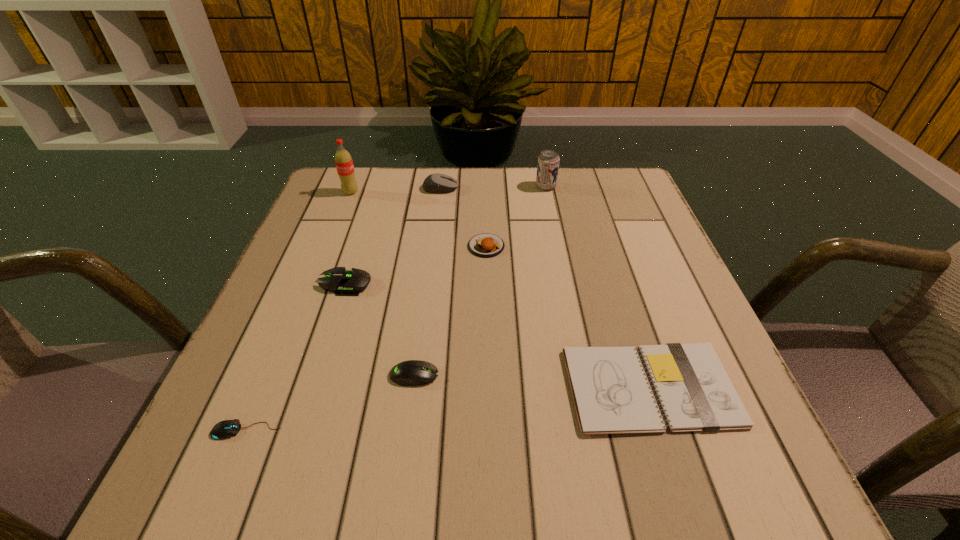
Identify the location of free space between the notepad and the second nearest mouse. (533, 381).

Find the location of a particular element. The image size is (960, 540). free space between the patty (food) and the third nearest mouse is located at coordinates (416, 265).

Locate which object is the sixth closest to the sixth object from left to right. Please provide its 2D coordinates. Your answer should be formatted as a tuple, i.e. [(x, y)], where the tuple contains the x and y coordinates of a point satisfying the conditions above.

[(344, 164)]

The height and width of the screenshot is (540, 960). In order to click on the closest object to the third nearest mouse in this screenshot , I will do `click(412, 372)`.

This screenshot has width=960, height=540. Identify the location of the second closest mouse to the fifth farthest object. (228, 428).

Find the location of a particular element. Image resolution: width=960 pixels, height=540 pixels. mouse that is the third closest to the fifth nearest object is located at coordinates (412, 372).

The width and height of the screenshot is (960, 540). Find the location of `vacant space that satisfies the following two spatial constraints: 1. on the back side of the patty (food); 2. on the left side of the third nearest mouse`. vacant space that satisfies the following two spatial constraints: 1. on the back side of the patty (food); 2. on the left side of the third nearest mouse is located at coordinates (358, 246).

This screenshot has height=540, width=960. What are the coordinates of `vacant space that satisfies the following two spatial constraints: 1. on the front side of the tallest object; 2. on the left side of the notepad` in the screenshot? It's located at (274, 387).

Locate an element on the screen. This screenshot has height=540, width=960. free spot that satisfies the following two spatial constraints: 1. on the wheel side of the tallest mouse; 2. on the front side of the third nearest mouse is located at coordinates (429, 284).

Identify the location of vacant space that satisfies the following two spatial constraints: 1. on the wheel side of the third tallest object; 2. on the back side of the patty (food). (434, 246).